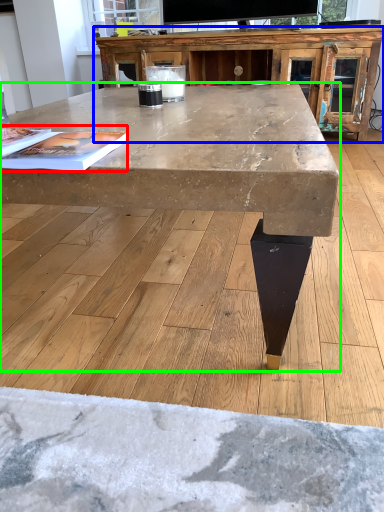
Question: Which is nearer to the magazine (highlighted by a red box)? entertainment center (highlighted by a blue box) or coffee table (highlighted by a green box).

Choices:
 (A) entertainment center
 (B) coffee table

Answer: (B)